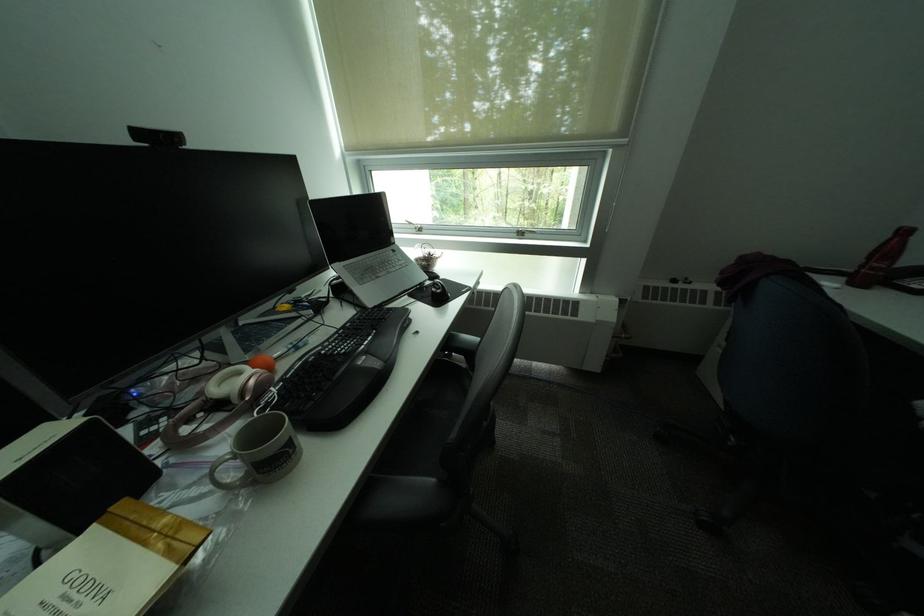
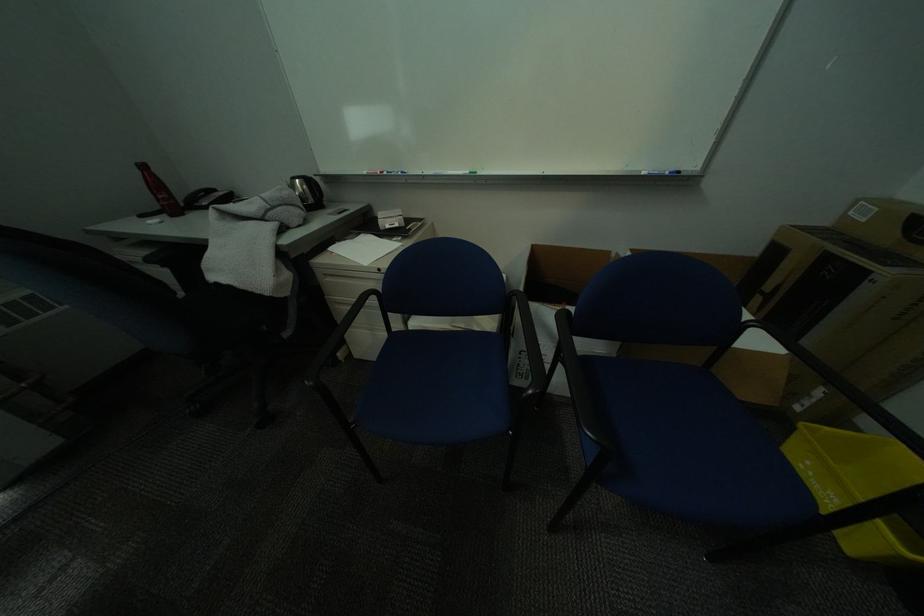
Based on the photo, first-person continuous shooting, in which direction is the camera rotating?

The camera's rotation is toward right-down.